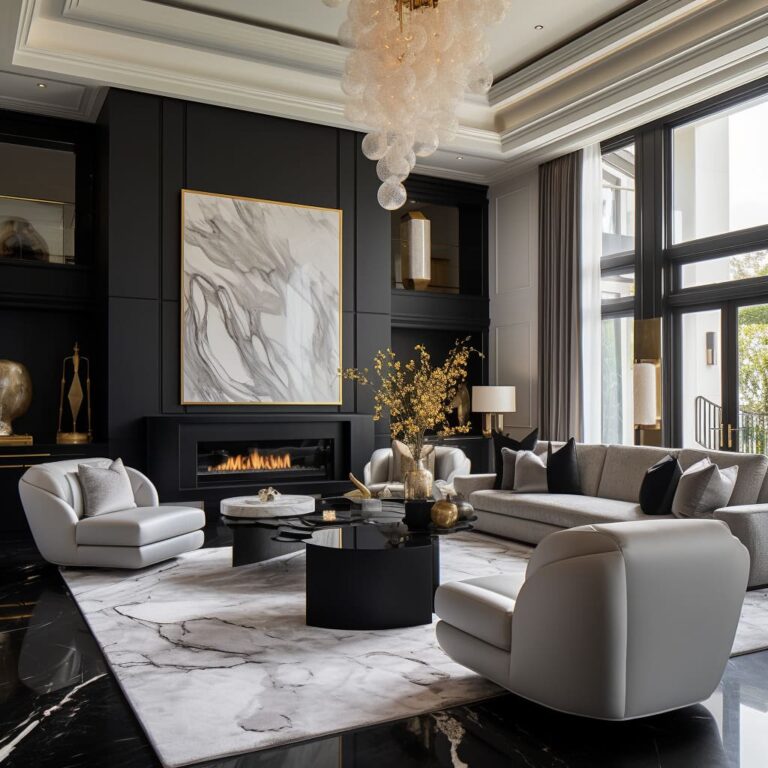
At what (x,y) coordinates should I click in order to perform the action: click on table. Please return your answer as a coordinate pair (x, y). Looking at the image, I should click on (339, 548).